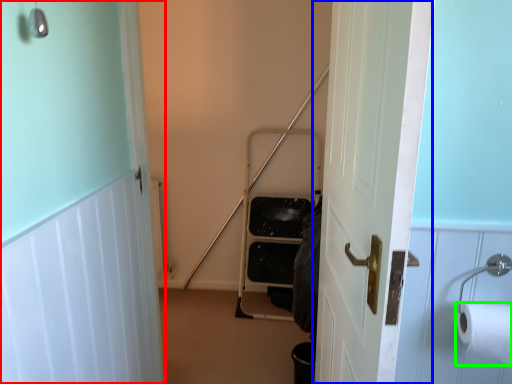
Question: Which object is the farthest from door (highlighted by a red box)? Choose among these: door (highlighted by a blue box) or toilet paper (highlighted by a green box).

Choices:
 (A) door
 (B) toilet paper

Answer: (B)